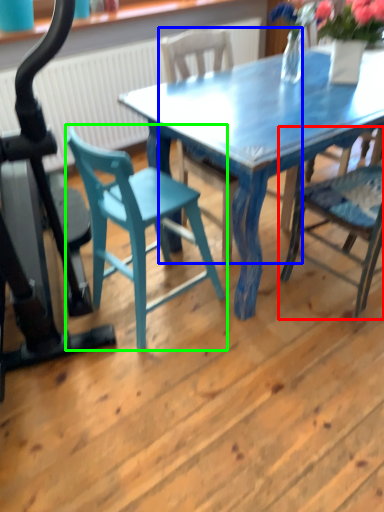
Question: Based on their relative distances, which object is nearer to chair (highlighted by a red box)? Choose from chair (highlighted by a blue box) and chair (highlighted by a green box).

Choices:
 (A) chair
 (B) chair

Answer: (B)